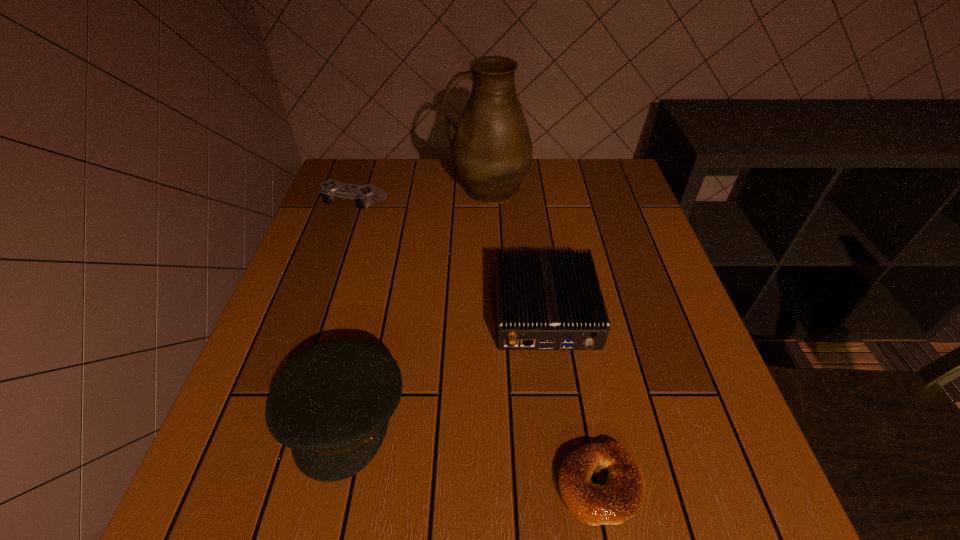
At what (x,y) coordinates should I click in order to perform the action: click on free region that satisfies the following two spatial constraints: 1. on the back panel of the shortest object; 2. on the left side of the third farthest object. Please return your answer as a coordinate pair (x, y). Looking at the image, I should click on (568, 484).

Find the location of `blank space that satisfies the following two spatial constraints: 1. on the front-facing side of the second tallest object; 2. on the right side of the bagel`. blank space that satisfies the following two spatial constraints: 1. on the front-facing side of the second tallest object; 2. on the right side of the bagel is located at coordinates (327, 484).